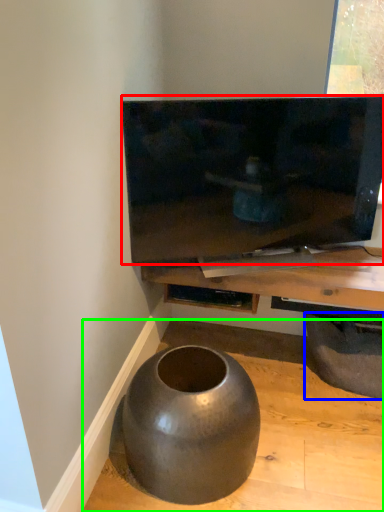
Question: Estimate the real-world distances between objects in this image. Which object is closer to television (highlighted by a red box), tire (highlighted by a blue box) or concrete (highlighted by a green box)?

Choices:
 (A) tire
 (B) concrete

Answer: (A)